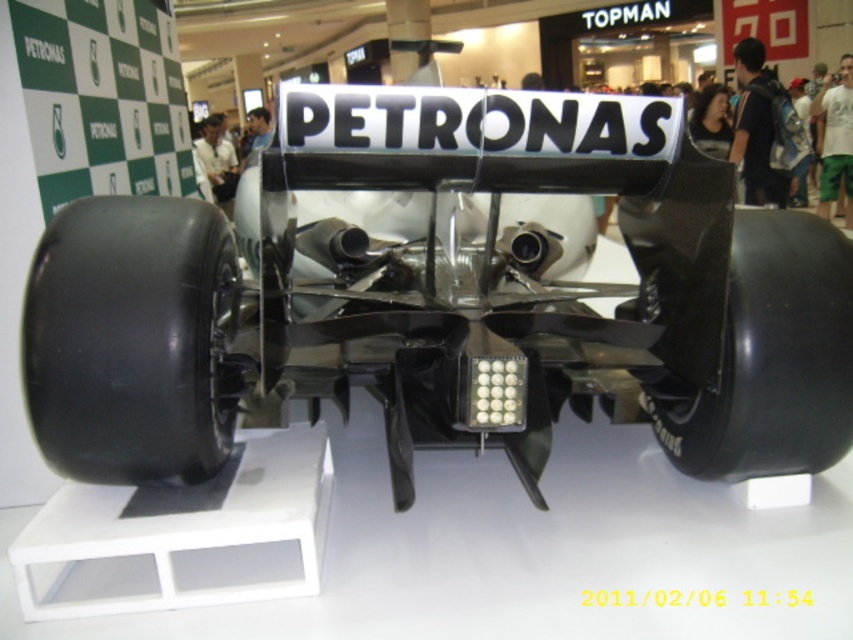
You are a photographer setting up a shoot in the mall. You want to capture both the carbon fiber race car at center and the black rubber wheel at lower left in the same frame. Given their sizes, which object should you focus on first to ensure both are clearly visible?

The carbon fiber race car at center is larger in size than the black rubber wheel at lower left. To ensure both are clearly visible, focus on the carbon fiber race car at center first, as its larger size will require more attention to detail in the composition.

You are a delivery person who needs to move a box from the black rubber wheel at lower left to the black carbon fiber wheel at center. The box is 1.5 meters long. Can you slide the box horizontally between them without bending it?

The distance between the black rubber wheel at lower left and the black carbon fiber wheel at center is 1.48 meters, which is shorter than the box length of 1.5 meters. Therefore, the box cannot be slid horizontally between them without bending.

You are a store manager at the mall and want to display both the black rubber wheel at lower left and the black carbon fiber wheel at center in a narrow display case. Which wheel should you choose to fit better in the case if space is limited?

The black rubber wheel at lower left occupies less space than the black carbon fiber wheel at center, so it would fit better in the narrow display case.